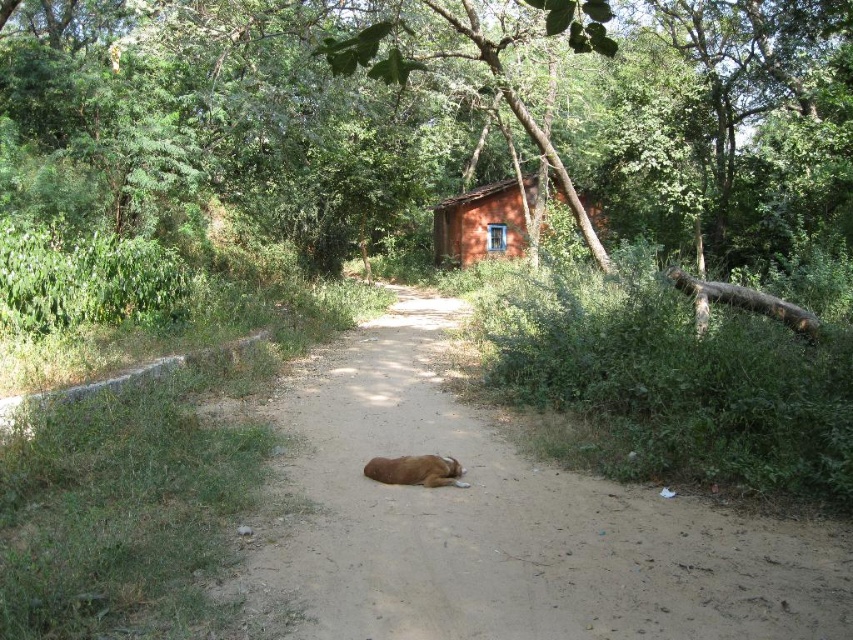
Question: Does brown dirt track at center appear under brown furry dog at center?

Choices:
 (A) yes
 (B) no

Answer: (B)

Question: Which object is farther from the camera taking this photo?

Choices:
 (A) brown dirt track at center
 (B) brown furry dog at center

Answer: (B)

Question: Among these objects, which one is nearest to the camera?

Choices:
 (A) brown dirt track at center
 (B) orange clay cabin at center
 (C) brown furry dog at center

Answer: (A)

Question: Estimate the real-world distances between objects in this image. Which object is farther from the brown furry dog at center?

Choices:
 (A) brown dirt track at center
 (B) orange clay cabin at center

Answer: (B)

Question: Observing the image, what is the correct spatial positioning of brown dirt track at center in reference to orange clay cabin at center?

Choices:
 (A) below
 (B) above

Answer: (A)

Question: Is brown dirt track at center wider than orange clay cabin at center?

Choices:
 (A) no
 (B) yes

Answer: (A)